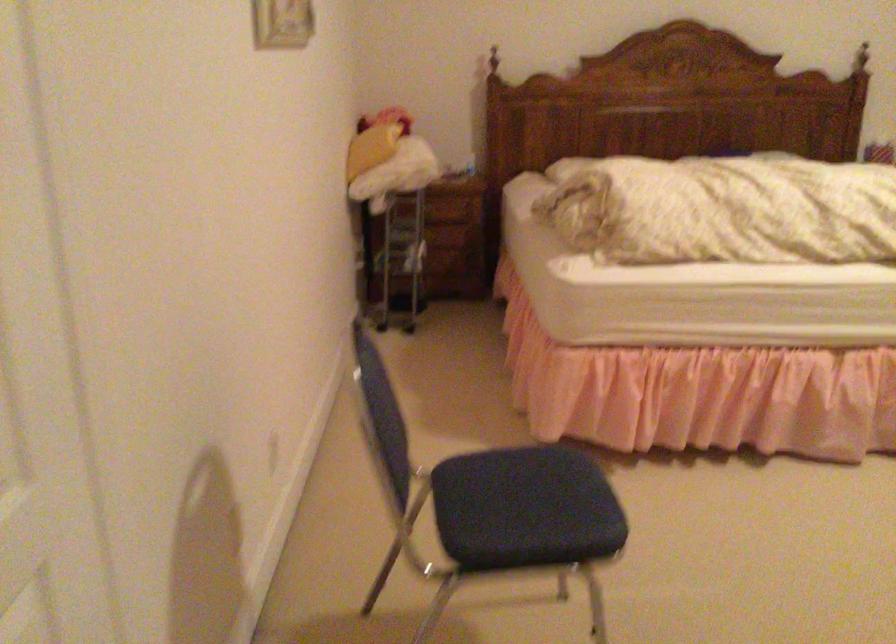
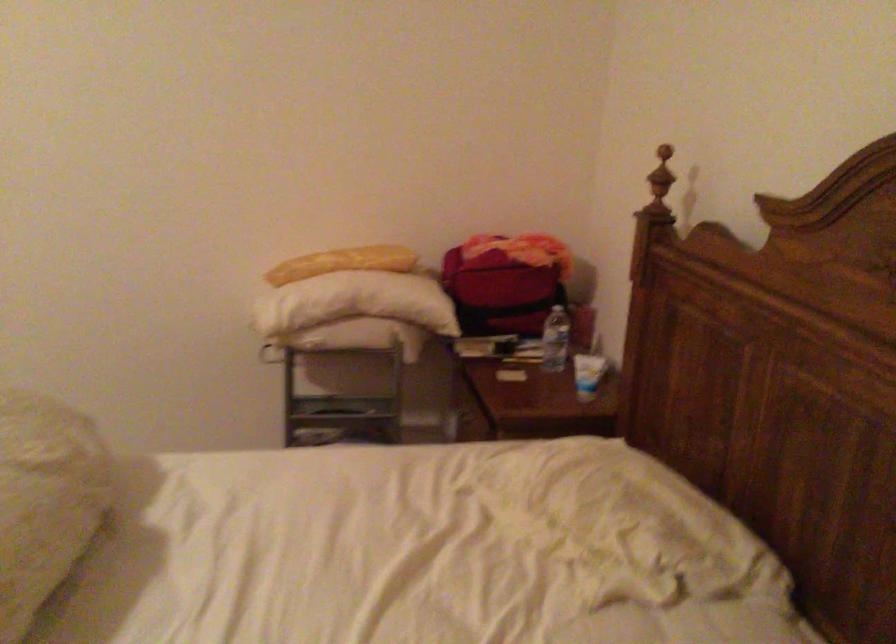
Where in the second image is the point corresponding to (x=407, y=125) from the first image?

(504, 281)